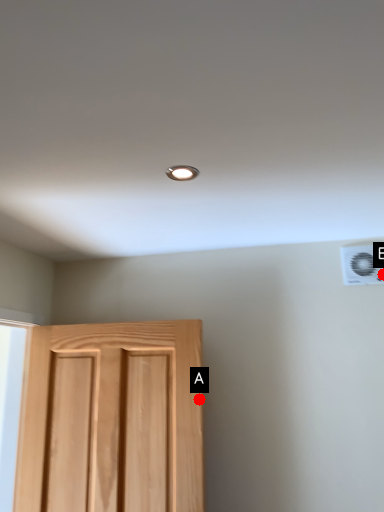
Question: Two points are circled on the image, labeled by A and B beside each circle. Which of the following is the closest to the observer?

Choices:
 (A) A is closer
 (B) B is closer

Answer: (A)